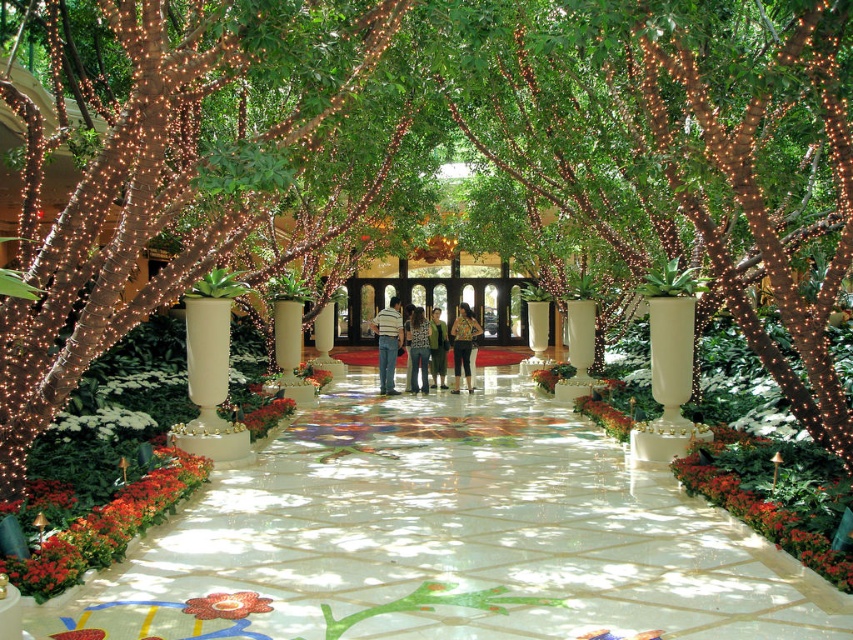
Can you confirm if striped cotton shirt at center is smaller than green matte flower at center?

Correct, striped cotton shirt at center occupies less space than green matte flower at center.

Is point (389, 324) farther from viewer compared to point (297, 369)?

No, (389, 324) is closer to viewer.

Locate an element on the screen. striped cotton shirt at center is located at coordinates (387, 342).

Find the location of a particular element. This screenshot has width=853, height=640. striped cotton shirt at center is located at coordinates (387, 342).

Between green leafy plant at lower right and denim jeans at center, which one is positioned higher?

denim jeans at center is above.

Can you confirm if green leafy plant at lower right is positioned above denim jeans at center?

Incorrect, green leafy plant at lower right is not positioned above denim jeans at center.

Does point (799, 538) come in front of point (428, 356)?

Yes, it is.

Locate an element on the screen. green leafy plant at lower right is located at coordinates tap(758, 506).

From the picture: Does white glossy marble at center appear over shiny brown bark at center?

Actually, white glossy marble at center is below shiny brown bark at center.

Is white glossy marble at center wider than shiny brown bark at center?

No, white glossy marble at center is not wider than shiny brown bark at center.

Is point (310, 634) farther from viewer compared to point (381, 28)?

No, (310, 634) is in front of (381, 28).

This screenshot has height=640, width=853. What are the coordinates of `white glossy marble at center` in the screenshot? It's located at (450, 536).